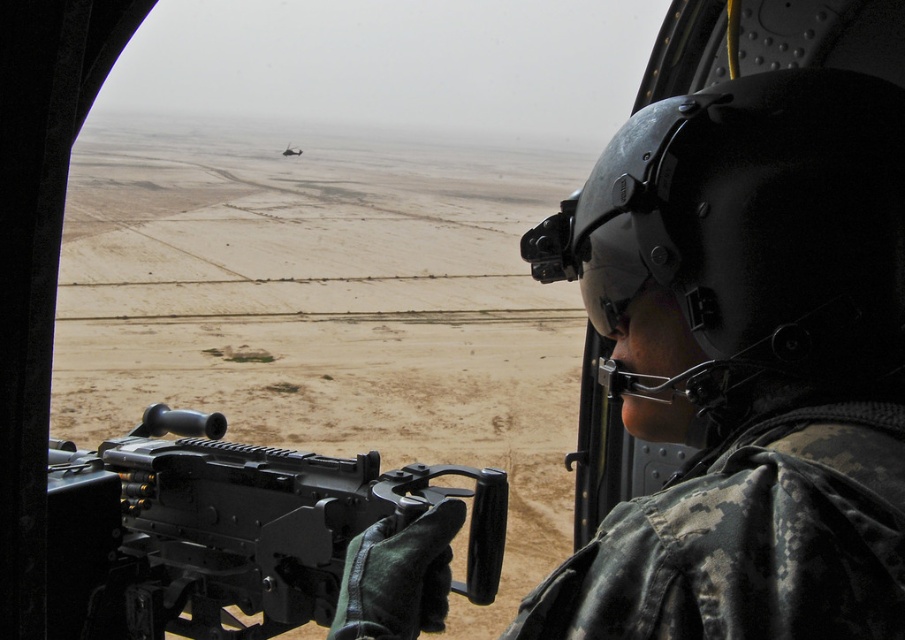
Question: Can you confirm if black matte rifle at center is positioned above dark gray metallic helicopter at upper center?

Choices:
 (A) no
 (B) yes

Answer: (A)

Question: Can you confirm if black matte rifle at center is positioned to the right of dark gray metallic helicopter at upper center?

Choices:
 (A) no
 (B) yes

Answer: (B)

Question: Can you confirm if black matte rifle at center is wider than dark gray metallic helicopter at upper center?

Choices:
 (A) no
 (B) yes

Answer: (A)

Question: Among these objects, which one is nearest to the camera?

Choices:
 (A) dark gray metallic helicopter at upper center
 (B) black matte rifle at center

Answer: (B)

Question: Which point is farther from the camera taking this photo?

Choices:
 (A) (298, 156)
 (B) (348, 467)

Answer: (A)